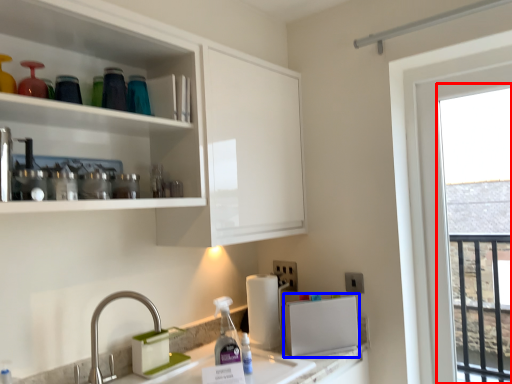
Question: Which point is closer to the camera, window (highlighted by a red box) or appliance (highlighted by a blue box)?

Choices:
 (A) window
 (B) appliance

Answer: (A)